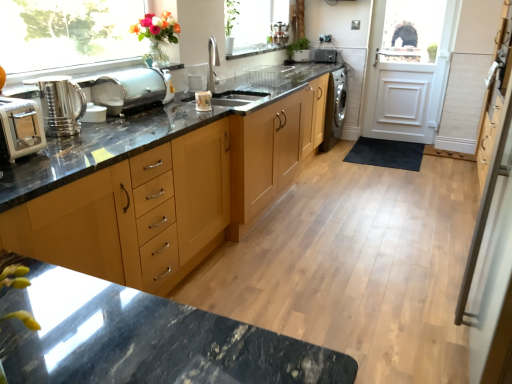
Question: From a real-world perspective, is shiny metallic kettle at left above or below silver metallic screen door at right?

Choices:
 (A) above
 (B) below

Answer: (A)

Question: Would you say shiny metallic kettle at left is inside or outside silver metallic screen door at right?

Choices:
 (A) inside
 (B) outside

Answer: (B)

Question: Which object is the farthest from the white wooden door at upper right?

Choices:
 (A) white matte vase at upper center
 (B) satin silver bread bin at center, the second appliance from the bottom
 (C) satin black camera at center, arranged as the third appliance when ordered from the bottom
 (D) white plastic toaster at left
 (E) silver metallic screen door at right

Answer: (D)

Question: Estimate the real-world distances between objects in this image. Which object is farther from the white plastic toaster at left?

Choices:
 (A) shiny metallic kettle at left
 (B) white wooden door at upper right
 (C) satin silver bread bin at center, the second appliance from the bottom
 (D) satin black camera at center, arranged as the third appliance when ordered from the bottom
 (E) light wood cabinet at center

Answer: (B)